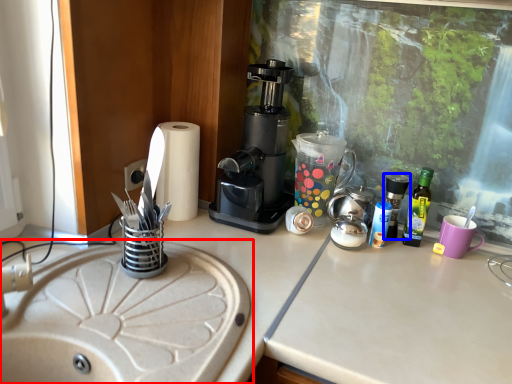
Question: Which of the following is the farthest to the observer, sink (highlighted by a red box) or bottle (highlighted by a blue box)?

Choices:
 (A) sink
 (B) bottle

Answer: (B)